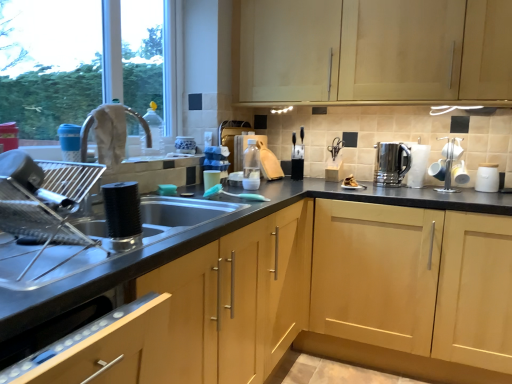
Where is `vacant space to the left of matte plastic cup at sink, the fourth appliance from the right`? Image resolution: width=512 pixels, height=384 pixels. vacant space to the left of matte plastic cup at sink, the fourth appliance from the right is located at coordinates (172, 194).